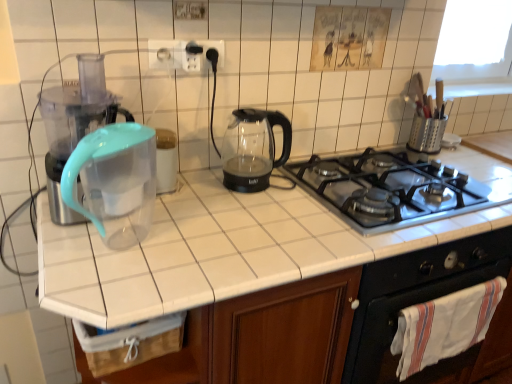
Question: Is metallic gray gas stove at center bigger or smaller than transparent plastic water filter pitcher at left?

Choices:
 (A) small
 (B) big

Answer: (B)

Question: From a real-world perspective, is metallic gray gas stove at center above or below transparent plastic water filter pitcher at left?

Choices:
 (A) below
 (B) above

Answer: (A)

Question: Based on their relative distances, which object is nearer to the transparent plastic pitcher at left?

Choices:
 (A) metallic gray gas stove at center
 (B) transparent plastic blender at left
 (C) white plastic socket at upper center, the 1th electric outlet from the left
 (D) transparent glass kettle at center
 (E) wooden crate at lower left

Answer: (E)

Question: Considering the real-world distances, which object is farthest from the transparent plastic water filter pitcher at left?

Choices:
 (A) transparent plastic blender at left
 (B) black matte oven at lower right
 (C) wooden crate at lower left
 (D) white plastic socket at upper center, the 2th electric outlet when ordered from right to left
 (E) transparent plastic pitcher at left

Answer: (B)